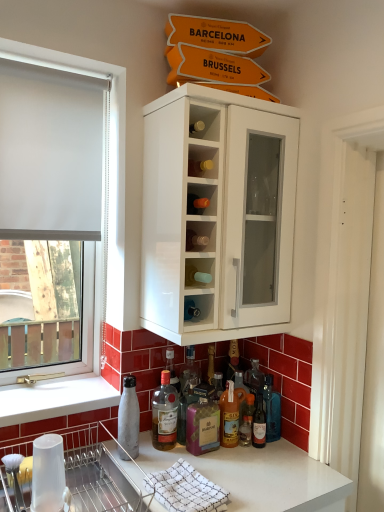
Question: Is translucent glass bottle at lower center, which is the 4th bottle from right to left, outside of translucent glass bottle at lower center, which is the 1th bottle from right to left?

Choices:
 (A) yes
 (B) no

Answer: (A)

Question: Considering the relative positions of translucent glass bottle at lower center, which is the 4th bottle from right to left, and translucent glass bottle at lower center, the sixth bottle when ordered from left to right, in the image provided, is translucent glass bottle at lower center, which is the 4th bottle from right to left, to the right of translucent glass bottle at lower center, the sixth bottle when ordered from left to right, from the viewer's perspective?

Choices:
 (A) no
 (B) yes

Answer: (A)

Question: Is translucent glass bottle at lower center, which is the 4th bottle from right to left, next to translucent glass bottle at lower center, which is the 1th bottle from right to left, and touching it?

Choices:
 (A) yes
 (B) no

Answer: (B)

Question: Is translucent glass bottle at lower center, which is the 3th bottle in left-to-right order, taller than translucent glass bottle at lower center, which is the 1th bottle from right to left?

Choices:
 (A) yes
 (B) no

Answer: (B)

Question: Does translucent glass bottle at lower center, which is the 3th bottle in left-to-right order, have a lesser width compared to translucent glass bottle at lower center, the sixth bottle when ordered from left to right?

Choices:
 (A) no
 (B) yes

Answer: (B)

Question: Is translucent glass bottle at lower center in front of or behind metallic silver bottle at lower left, the sixth bottle positioned from the right, in the image?

Choices:
 (A) behind
 (B) front

Answer: (A)

Question: Considering the relative positions of translucent glass bottle at lower center and metallic silver bottle at lower left, the first bottle from the left, in the image provided, is translucent glass bottle at lower center to the left or to the right of metallic silver bottle at lower left, the first bottle from the left,?

Choices:
 (A) right
 (B) left

Answer: (A)

Question: From the image's perspective, relative to metallic silver bottle at lower left, the sixth bottle positioned from the right, is translucent glass bottle at lower center above or below?

Choices:
 (A) above
 (B) below

Answer: (B)

Question: Is translucent glass bottle at lower center bigger or smaller than metallic silver bottle at lower left, the sixth bottle positioned from the right?

Choices:
 (A) small
 (B) big

Answer: (B)

Question: From a real-world perspective, is transparent plastic cup at lower left physically located above or below translucent glass bottle at lower center, the fifth bottle positioned from the left?

Choices:
 (A) above
 (B) below

Answer: (A)

Question: Considering the relative positions of transparent plastic cup at lower left and translucent glass bottle at lower center, placed as the 2th bottle when sorted from right to left, in the image provided, is transparent plastic cup at lower left to the left or to the right of translucent glass bottle at lower center, placed as the 2th bottle when sorted from right to left,?

Choices:
 (A) right
 (B) left

Answer: (B)

Question: Does point (64, 466) appear closer or farther from the camera than point (264, 442)?

Choices:
 (A) farther
 (B) closer

Answer: (B)

Question: Considering the positions of transparent plastic cup at lower left and translucent glass bottle at lower center, the fifth bottle positioned from the left, in the image, is transparent plastic cup at lower left bigger or smaller than translucent glass bottle at lower center, the fifth bottle positioned from the left,?

Choices:
 (A) big
 (B) small

Answer: (A)

Question: From the image's perspective, is metallic silver dish rack at lower left positioned above or below purple glass bottle at center, positioned as the 5th bottle in right-to-left order?

Choices:
 (A) below
 (B) above

Answer: (A)

Question: In the image, is metallic silver dish rack at lower left on the left side or the right side of purple glass bottle at center, positioned as the 5th bottle in right-to-left order?

Choices:
 (A) left
 (B) right

Answer: (A)